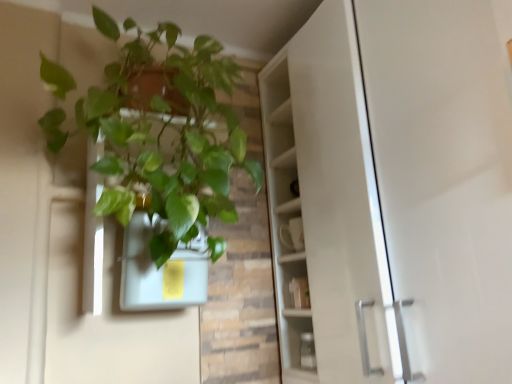
Identify the location of matte white flowerpot at upper left. Image resolution: width=512 pixels, height=384 pixels. (161, 269).

What is the approximate width of matte white flowerpot at upper left?

matte white flowerpot at upper left is 6.15 inches wide.

Describe the element at coordinates (161, 269) in the screenshot. I see `matte white flowerpot at upper left` at that location.

The image size is (512, 384). What do you see at coordinates (176, 137) in the screenshot?
I see `green matte plant at upper left` at bounding box center [176, 137].

At what (x,y) coordinates should I click in order to perform the action: click on green matte plant at upper left. Please return your answer as a coordinate pair (x, y). Looking at the image, I should click on (176, 137).

Locate an element on the screen. The image size is (512, 384). matte white flowerpot at upper left is located at coordinates (161, 269).

Is green matte plant at upper left at the left side of matte white flowerpot at upper left?

Correct, you'll find green matte plant at upper left to the left of matte white flowerpot at upper left.

Considering the positions of objects green matte plant at upper left and matte white flowerpot at upper left in the image provided, who is behind, green matte plant at upper left or matte white flowerpot at upper left?

matte white flowerpot at upper left.

Which is closer, (169, 237) or (187, 303)?

The point (169, 237) is closer to the camera.

From the image's perspective, is green matte plant at upper left under matte white flowerpot at upper left?

Actually, green matte plant at upper left appears above matte white flowerpot at upper left in the image.

From the picture: From a real-world perspective, is green matte plant at upper left physically located above or below matte white flowerpot at upper left?

In terms of real-world spatial position, green matte plant at upper left is above matte white flowerpot at upper left.

Does green matte plant at upper left have a greater width compared to matte white flowerpot at upper left?

Yes, green matte plant at upper left is wider than matte white flowerpot at upper left.

Who is shorter, green matte plant at upper left or matte white flowerpot at upper left?

With less height is matte white flowerpot at upper left.

Considering the relative sizes of green matte plant at upper left and matte white flowerpot at upper left in the image provided, is green matte plant at upper left bigger than matte white flowerpot at upper left?

Indeed, green matte plant at upper left has a larger size compared to matte white flowerpot at upper left.

Is green matte plant at upper left spatially inside matte white flowerpot at upper left, or outside of it?

green matte plant at upper left exists outside the volume of matte white flowerpot at upper left.

Is green matte plant at upper left in contact with matte white flowerpot at upper left?

No, green matte plant at upper left is not with matte white flowerpot at upper left.

Is green matte plant at upper left looking in the opposite direction of matte white flowerpot at upper left?

Yes, green matte plant at upper left is facing away from matte white flowerpot at upper left.

How far apart are green matte plant at upper left and matte white flowerpot at upper left?

green matte plant at upper left and matte white flowerpot at upper left are 8.29 inches apart.

The height and width of the screenshot is (384, 512). What are the coordinates of `houseplant positioned vertically above the matte white flowerpot at upper left (from a real-world perspective)` in the screenshot? It's located at (176, 137).

Does matte white flowerpot at upper left appear on the left side of green matte plant at upper left?

Incorrect, matte white flowerpot at upper left is not on the left side of green matte plant at upper left.

Does matte white flowerpot at upper left come in front of green matte plant at upper left?

No, it is not.

Is point (135, 288) positioned after point (49, 140)?

No, it is in front of (49, 140).

From the image's perspective, does matte white flowerpot at upper left appear lower than green matte plant at upper left?

Yes, from the image's perspective, matte white flowerpot at upper left is below green matte plant at upper left.

From a real-world perspective, who is located lower, matte white flowerpot at upper left or green matte plant at upper left?

From a 3D spatial view, matte white flowerpot at upper left is below.

Can you confirm if matte white flowerpot at upper left is thinner than green matte plant at upper left?

Correct, the width of matte white flowerpot at upper left is less than that of green matte plant at upper left.

In terms of height, does matte white flowerpot at upper left look taller or shorter compared to green matte plant at upper left?

Clearly, matte white flowerpot at upper left is shorter compared to green matte plant at upper left.

Is matte white flowerpot at upper left bigger than green matte plant at upper left?

Incorrect, matte white flowerpot at upper left is not larger than green matte plant at upper left.

Choose the correct answer: Is matte white flowerpot at upper left inside green matte plant at upper left or outside it?

The correct answer is: inside.

In the scene shown: Are matte white flowerpot at upper left and green matte plant at upper left far apart?

No.

Is matte white flowerpot at upper left turned away from green matte plant at upper left?

That's right, matte white flowerpot at upper left is facing away from green matte plant at upper left.

The height and width of the screenshot is (384, 512). Find the location of `flowerpot behind the green matte plant at upper left`. flowerpot behind the green matte plant at upper left is located at coordinates (161, 269).

Find the location of a particular element. The image size is (512, 384). flowerpot below the green matte plant at upper left (from the image's perspective) is located at coordinates (161, 269).

Identify the location of houseplant on the left of matte white flowerpot at upper left. (176, 137).